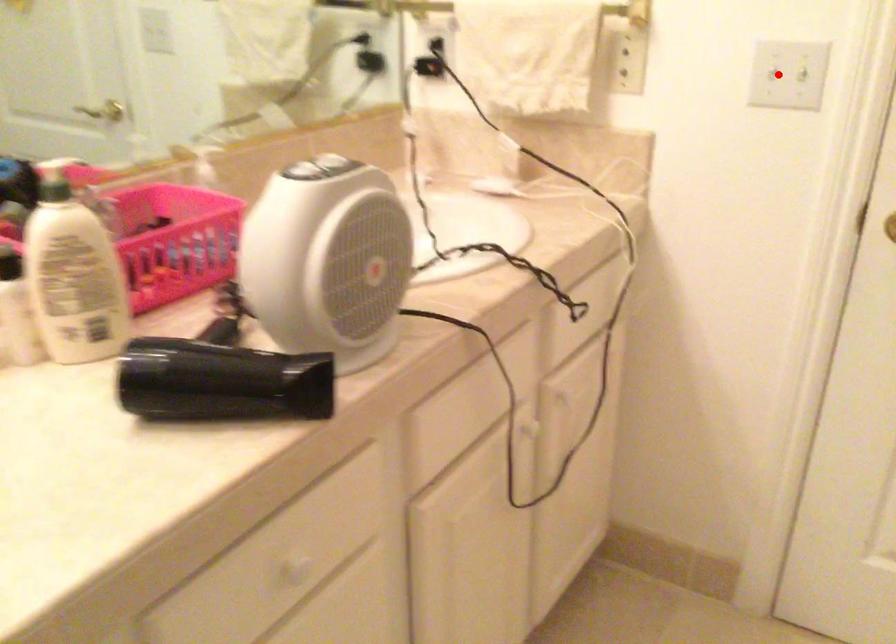
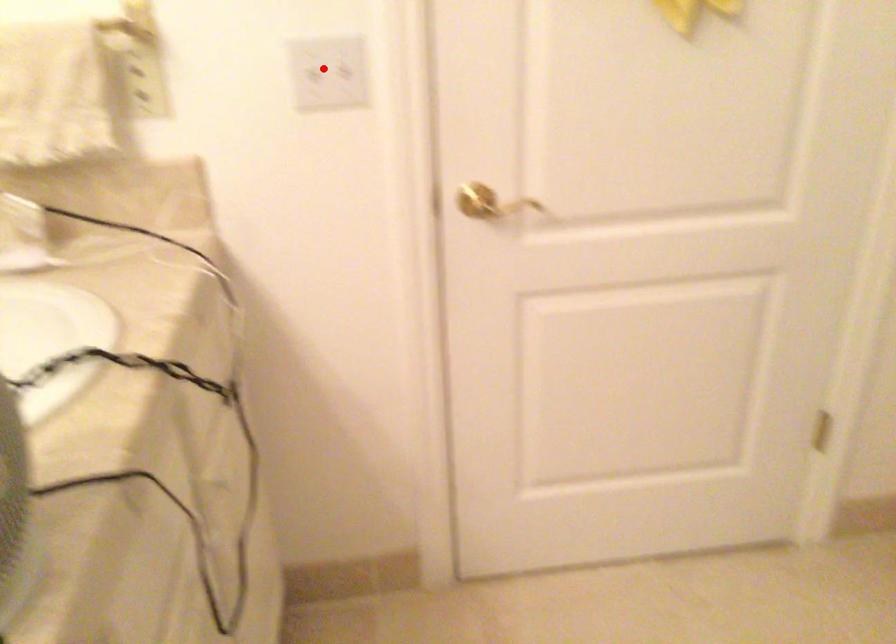
I am providing you with two images of the same scene from different viewpoints. A red point is marked on the first image and another point is marked on the second image. Is the red point in image1 aligned with the point shown in image2?

Yes